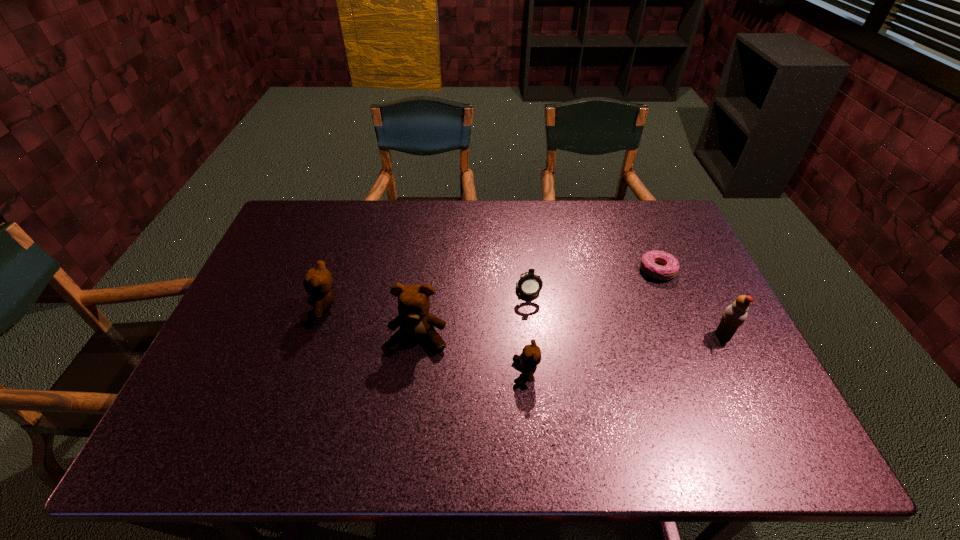
The image size is (960, 540). In order to click on vacant space situated 0.360m on the left of the doughnut in this screenshot , I will do `click(518, 270)`.

This screenshot has height=540, width=960. Find the location of `object that is at the near edge`. object that is at the near edge is located at coordinates (530, 357).

Where is `icecream that is positioned at the right edge`? The image size is (960, 540). icecream that is positioned at the right edge is located at coordinates (734, 315).

Locate an element on the screen. The image size is (960, 540). doughnut situated at the right edge is located at coordinates pyautogui.click(x=669, y=270).

Where is `free space at the far edge`? The width and height of the screenshot is (960, 540). free space at the far edge is located at coordinates (515, 237).

I want to click on free point at the near edge, so click(650, 404).

Identify the location of blank space at the left edge of the desktop. (256, 302).

I want to click on vacant space at the right edge of the desktop, so click(688, 279).

Find the location of a particular element. vacant space at the far left corner of the desktop is located at coordinates (331, 214).

In order to click on vacant space at the far right corner of the desktop in this screenshot , I will do `click(640, 202)`.